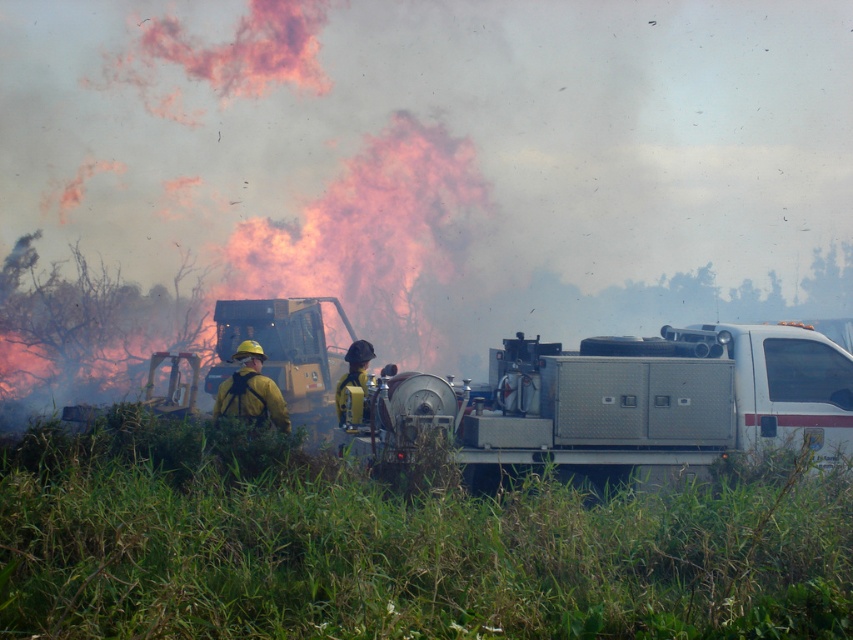
Does silver metallic fire truck at center have a lesser height compared to yellow matte fireman at center?

No, silver metallic fire truck at center is not shorter than yellow matte fireman at center.

Is silver metallic fire truck at center further to the viewer compared to yellow matte fireman at center?

No, silver metallic fire truck at center is in front of yellow matte fireman at center.

What are the coordinates of `silver metallic fire truck at center` in the screenshot? It's located at (619, 404).

The image size is (853, 640). Describe the element at coordinates (619, 404) in the screenshot. I see `silver metallic fire truck at center` at that location.

Based on the photo, which is below, silver metallic fire truck at center or yellow reflective vest at center?

yellow reflective vest at center is lower down.

You are a GUI agent. You are given a task and a screenshot of the screen. Output one action in this format:
    pyautogui.click(x=<x>, y=<y>)
    Task: Click on the silver metallic fire truck at center
    
    Given the screenshot: What is the action you would take?
    pyautogui.click(x=619, y=404)

The height and width of the screenshot is (640, 853). What are the coordinates of `silver metallic fire truck at center` in the screenshot? It's located at (619, 404).

Consider the image. Can you confirm if yellow matte fireman at center is shorter than yellow reflective vest at center?

Indeed, yellow matte fireman at center has a lesser height compared to yellow reflective vest at center.

Is yellow matte fireman at center positioned at the back of yellow reflective vest at center?

No, yellow matte fireman at center is closer to the viewer.

The width and height of the screenshot is (853, 640). Describe the element at coordinates (251, 390) in the screenshot. I see `yellow matte fireman at center` at that location.

The height and width of the screenshot is (640, 853). Identify the location of yellow matte fireman at center. (251, 390).